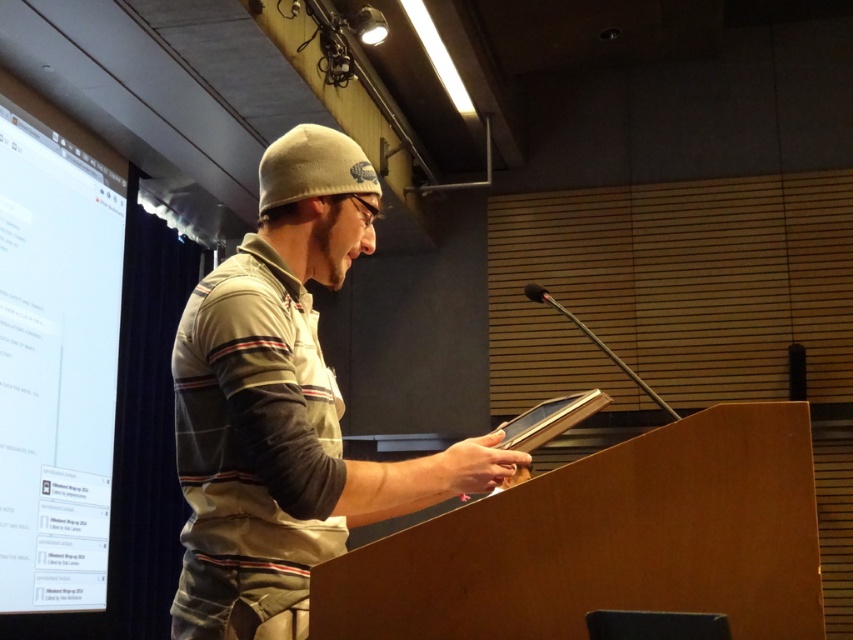
Question: Which point is farther to the camera?

Choices:
 (A) (196, 627)
 (B) (103, 276)

Answer: (B)

Question: Considering the relative positions of beige cotton polo shirt at center and white glossy projection screen at left in the image provided, where is beige cotton polo shirt at center located with respect to white glossy projection screen at left?

Choices:
 (A) left
 (B) right

Answer: (B)

Question: Does khaki cotton beanie at center have a greater width compared to white glossy projection screen at left?

Choices:
 (A) no
 (B) yes

Answer: (B)

Question: Can you confirm if khaki cotton beanie at center is positioned below beige cotton polo shirt at center?

Choices:
 (A) yes
 (B) no

Answer: (B)

Question: Based on their relative distances, which object is nearer to the beige cotton polo shirt at center?

Choices:
 (A) khaki cotton beanie at center
 (B) white glossy projection screen at left

Answer: (A)

Question: Among these points, which one is nearest to the camera?

Choices:
 (A) (263, 524)
 (B) (250, 388)

Answer: (B)